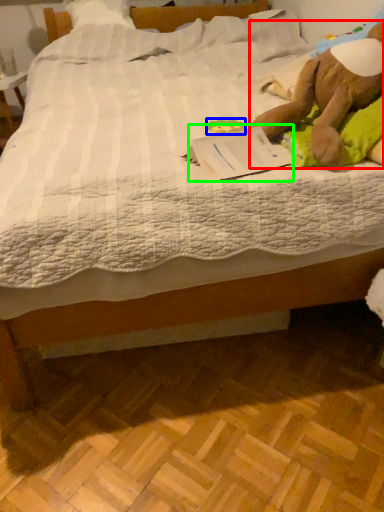
Question: Estimate the real-world distances between objects in this image. Which object is farther from animal (highlighted by a red box), toy (highlighted by a blue box) or paperback book (highlighted by a green box)?

Choices:
 (A) toy
 (B) paperback book

Answer: (A)